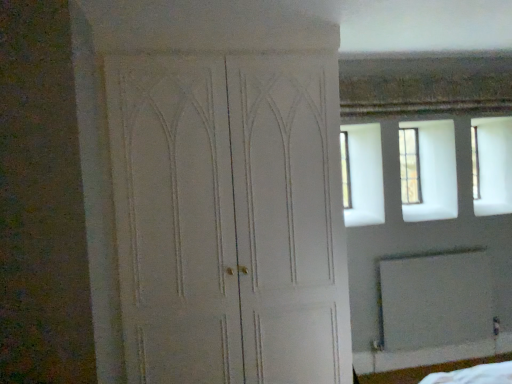
Question: Does point (159, 342) appear closer or farther from the camera than point (458, 307)?

Choices:
 (A) farther
 (B) closer

Answer: (B)

Question: Is white matte door at center bigger or smaller than white matte screen door at lower right?

Choices:
 (A) small
 (B) big

Answer: (B)

Question: Which of these objects is positioned farthest from the clear glass window at upper right?

Choices:
 (A) white matte screen door at lower right
 (B) white matte door at center

Answer: (B)

Question: Estimate the real-world distances between objects in this image. Which object is farther from the clear glass window at upper right?

Choices:
 (A) white matte door at center
 (B) white matte screen door at lower right

Answer: (A)